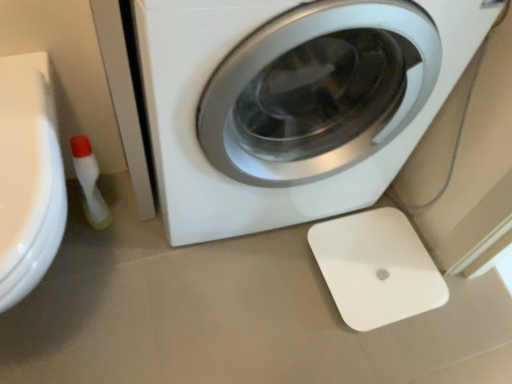
This screenshot has width=512, height=384. Identify the location of free location in front of white glossy washing machine at center. (211, 311).